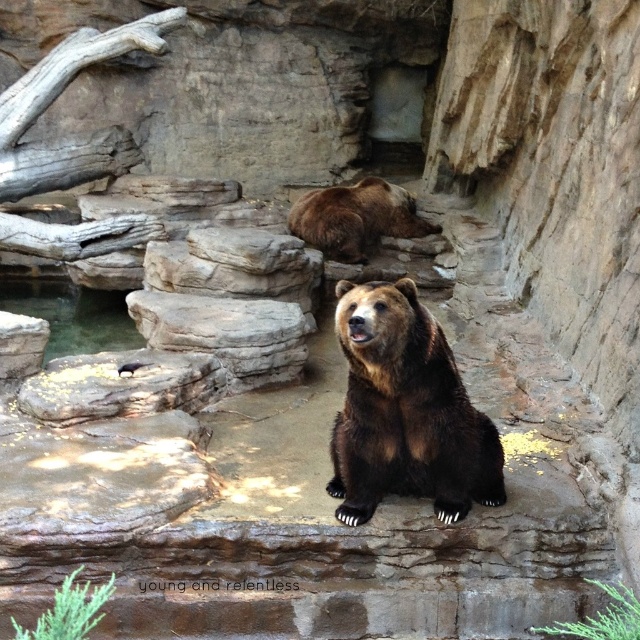
Question: Among these points, which one is nearest to the camera?

Choices:
 (A) (381, 420)
 (B) (332, 228)

Answer: (A)

Question: Which point is closer to the camera?

Choices:
 (A) (436, 451)
 (B) (387, 211)

Answer: (A)

Question: Can you confirm if brown furry bear at center is positioned below brown furry bear at upper center?

Choices:
 (A) no
 (B) yes

Answer: (B)

Question: Can you confirm if brown furry bear at center is positioned above brown furry bear at upper center?

Choices:
 (A) no
 (B) yes

Answer: (A)

Question: Can you confirm if brown furry bear at center is positioned to the right of brown furry bear at upper center?

Choices:
 (A) yes
 (B) no

Answer: (B)